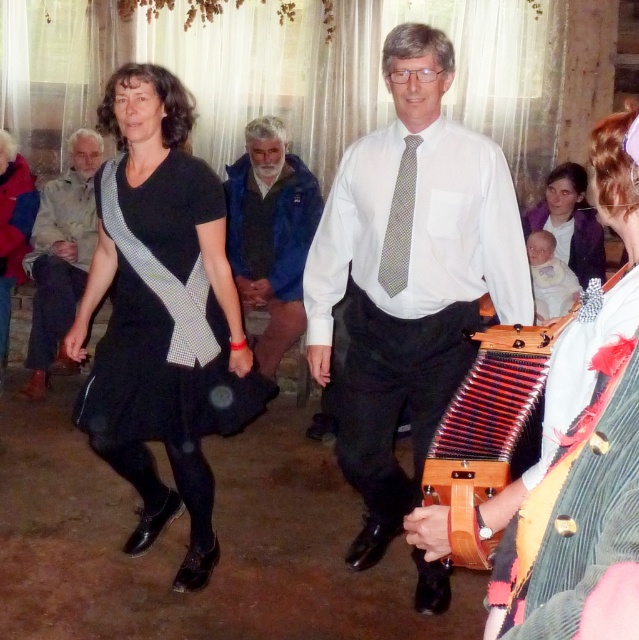
Is knitted wool sweater at right in front of light brown leather jacket at left?

Yes, knitted wool sweater at right is in front of light brown leather jacket at left.

Consider the image. Does knitted wool sweater at right have a lesser height compared to light brown leather jacket at left?

Indeed, knitted wool sweater at right has a lesser height compared to light brown leather jacket at left.

You are a GUI agent. You are given a task and a screenshot of the screen. Output one action in this format:
    pyautogui.click(x=<x>, y=<y>)
    Task: Click on the knitted wool sweater at right
    The height and width of the screenshot is (640, 639).
    Given the screenshot: What is the action you would take?
    pyautogui.click(x=580, y=522)

You are a GUI agent. You are given a task and a screenshot of the screen. Output one action in this format:
    pyautogui.click(x=<x>, y=<y>)
    Task: Click on the knitted wool sweater at right
    
    Given the screenshot: What is the action you would take?
    pyautogui.click(x=580, y=522)

Is white shirt at center wider than matte purple sweater at upper right?

Yes.

Who is taller, white shirt at center or matte purple sweater at upper right?

With more height is white shirt at center.

Is point (443, 284) farther from camera compared to point (574, 269)?

No, it is in front of (574, 269).

Locate an element on the screen. This screenshot has width=639, height=640. white shirt at center is located at coordinates (408, 276).

Between point (571, 490) and point (394, 252), which one is positioned behind?

Point (394, 252)

The width and height of the screenshot is (639, 640). Identify the location of knitted wool sweater at right. (580, 522).

Locate an element on the screen. The image size is (639, 640). knitted wool sweater at right is located at coordinates (580, 522).